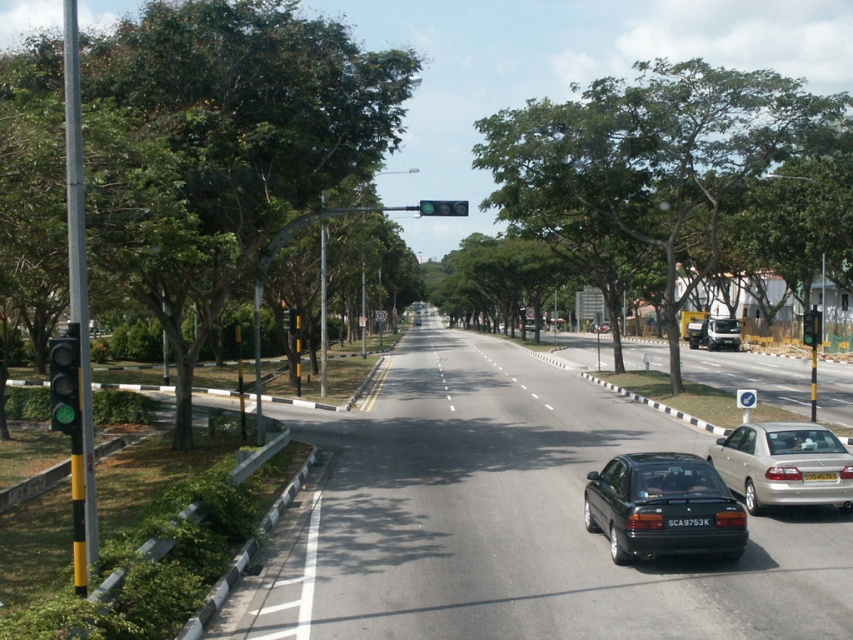
Question: Observing the image, what is the correct spatial positioning of green glass traffic light at left in reference to black plastic license plate at center?

Choices:
 (A) left
 (B) right

Answer: (A)

Question: Which object is positioned farthest from the green glass traffic light at center?

Choices:
 (A) metallic silver van at center
 (B) green leafy tree at left
 (C) yellow plastic license plate at center
 (D) green matte traffic light at center

Answer: (D)

Question: Estimate the real-world distances between objects in this image. Which object is closer to the metallic silver van at center?

Choices:
 (A) shiny black sedan at center
 (B) silver metallic sedan at right
 (C) green glass traffic light at left

Answer: (B)

Question: Which object appears closest to the camera in this image?

Choices:
 (A) shiny black sedan at center
 (B) green matte traffic light at center

Answer: (A)

Question: Can you confirm if green glass traffic light at left is wider than black plastic license plate at center?

Choices:
 (A) yes
 (B) no

Answer: (B)

Question: Can you confirm if green glass traffic light at left is wider than black plastic license plate at center?

Choices:
 (A) no
 (B) yes

Answer: (A)